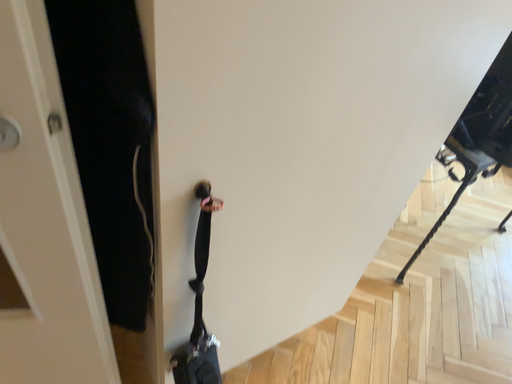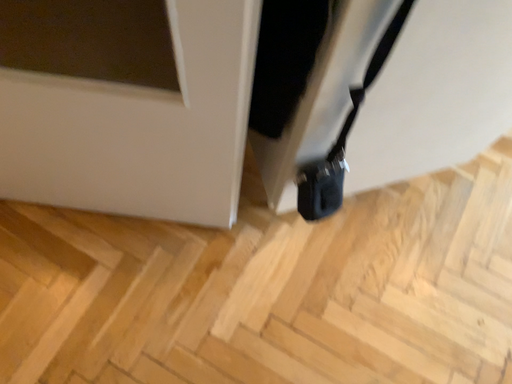
Question: Which way did the camera rotate in the video?

Choices:
 (A) rotated downward
 (B) rotated upward

Answer: (A)